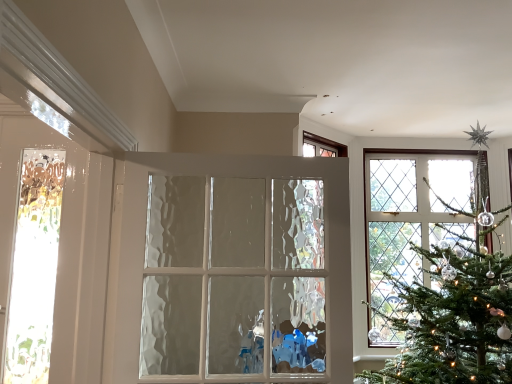
Question: From the image's perspective, is white textured glass door at center, which ranks as the 2th door in left-to-right order, positioned above or below translucent glass door at left, the second door when ordered from right to left?

Choices:
 (A) below
 (B) above

Answer: (A)

Question: Is white textured glass door at center, which ranks as the 2th door in left-to-right order, taller or shorter than translucent glass door at left, the second door when ordered from right to left?

Choices:
 (A) tall
 (B) short

Answer: (B)

Question: Would you say white textured glass door at center, which ranks as the 2th door in left-to-right order, is to the left or to the right of translucent glass door at left, the second door when ordered from right to left, in the picture?

Choices:
 (A) right
 (B) left

Answer: (A)

Question: Considering the relative positions of translucent glass door at left, which appears as the first door when viewed from the left, and white textured glass door at center, the first door when ordered from right to left, in the image provided, is translucent glass door at left, which appears as the first door when viewed from the left, to the left or to the right of white textured glass door at center, the first door when ordered from right to left,?

Choices:
 (A) right
 (B) left

Answer: (B)

Question: From a real-world perspective, is translucent glass door at left, which appears as the first door when viewed from the left, positioned above or below white textured glass door at center, which ranks as the 2th door in left-to-right order?

Choices:
 (A) above
 (B) below

Answer: (A)

Question: From the image's perspective, is translucent glass door at left, the second door when ordered from right to left, above or below white textured glass door at center, which ranks as the 2th door in left-to-right order?

Choices:
 (A) below
 (B) above

Answer: (B)

Question: Is point (92, 170) positioned closer to the camera than point (154, 185)?

Choices:
 (A) closer
 (B) farther

Answer: (A)